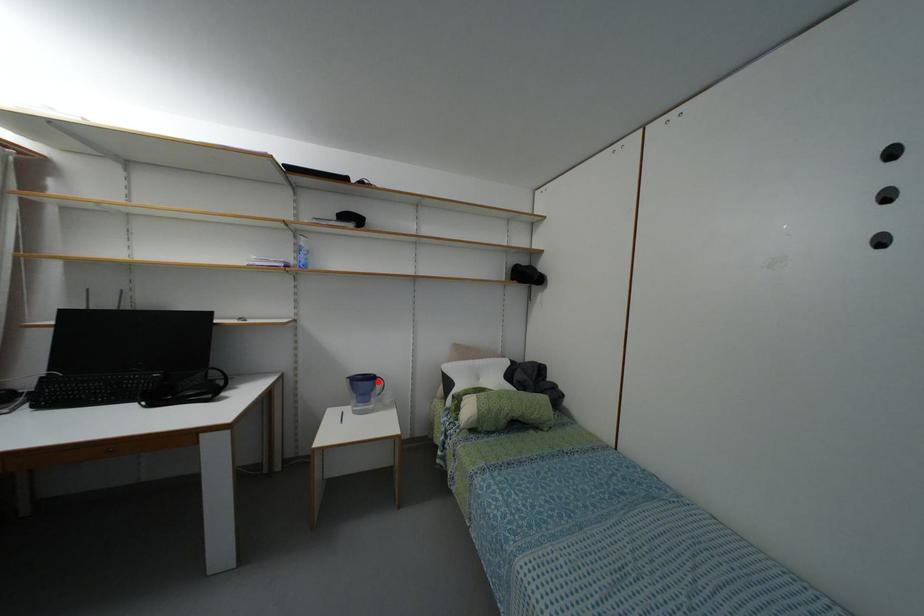
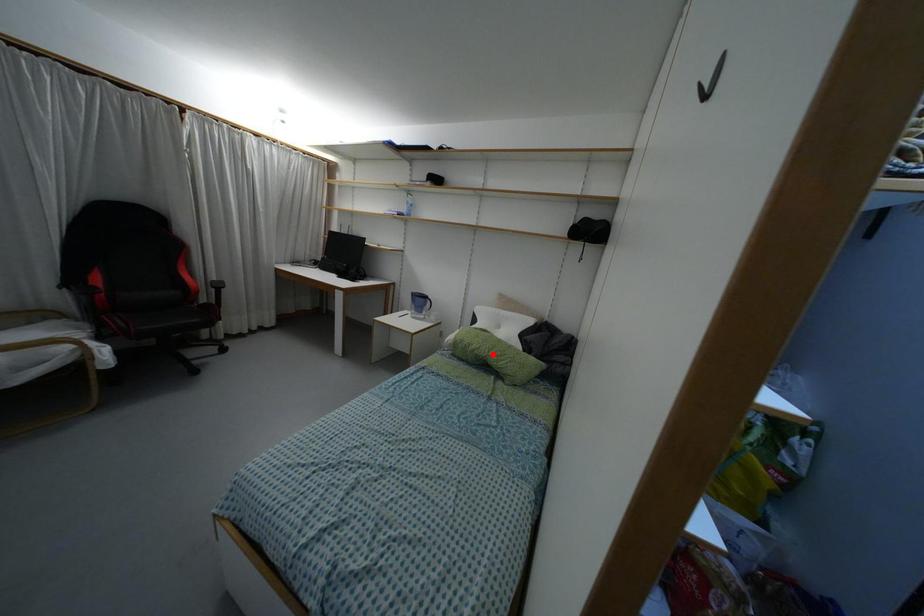
I am providing you with two images of the same scene from different viewpoints. A red point is marked on the first image and another point is marked on the second image. Is the red point in image1 aligned with the point shown in image2?

No